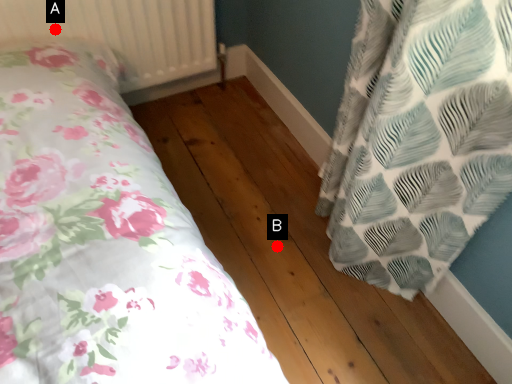
Question: Two points are circled on the image, labeled by A and B beside each circle. Which of the following is the farthest from the observer?

Choices:
 (A) A is further
 (B) B is further

Answer: (B)